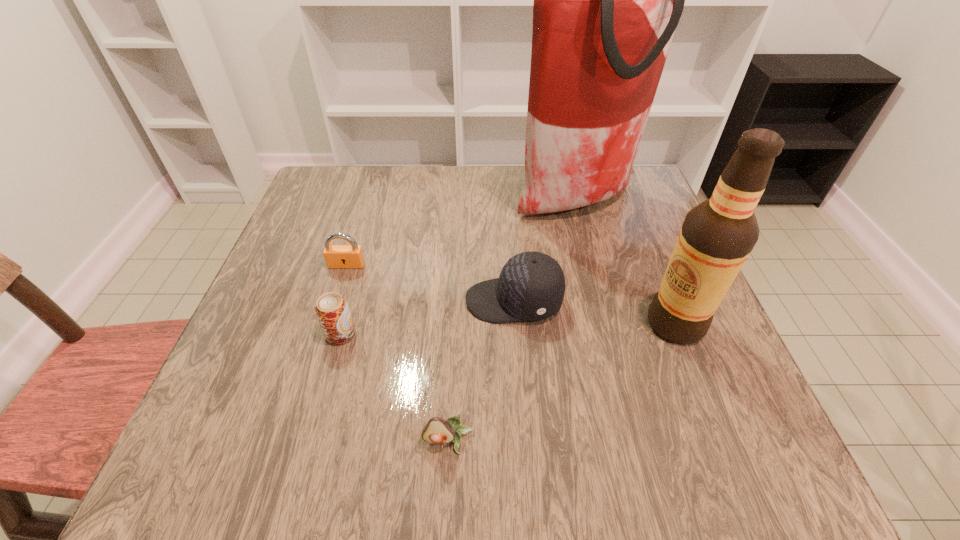
You are a GUI agent. You are given a task and a screenshot of the screen. Output one action in this format:
    pyautogui.click(x=<x>, y=<y>)
    Task: Click on the farthest object
    
    Given the screenshot: What is the action you would take?
    pyautogui.click(x=607, y=0)

At what (x,y) coordinates should I click in order to perform the action: click on the tallest object. Please return your answer as a coordinate pair (x, y). The image size is (960, 540). Looking at the image, I should click on (607, 0).

The height and width of the screenshot is (540, 960). What are the coordinates of `the second tallest object` in the screenshot? It's located at (717, 236).

Identify the location of the fourth shortest object. Image resolution: width=960 pixels, height=540 pixels. (531, 286).

You are a GUI agent. You are given a task and a screenshot of the screen. Output one action in this format:
    pyautogui.click(x=<x>, y=<y>)
    Task: Click on the beer can
    
    Given the screenshot: What is the action you would take?
    pyautogui.click(x=332, y=311)

Identify the location of padlock. (351, 256).

At what (x,y) coordinates should I click in order to perform the action: click on avocado. Please return your answer as a coordinate pair (x, y). The image size is (960, 540). Looking at the image, I should click on (438, 430).

The image size is (960, 540). Find the location of `free space located 0.250m on the front of the farthest object`. free space located 0.250m on the front of the farthest object is located at coordinates (605, 309).

This screenshot has width=960, height=540. Identify the location of vacant space located 0.400m on the label of the alcohol. point(443,324).

This screenshot has width=960, height=540. In order to click on vacant position located on the label of the alcohol in this screenshot , I will do `click(443, 324)`.